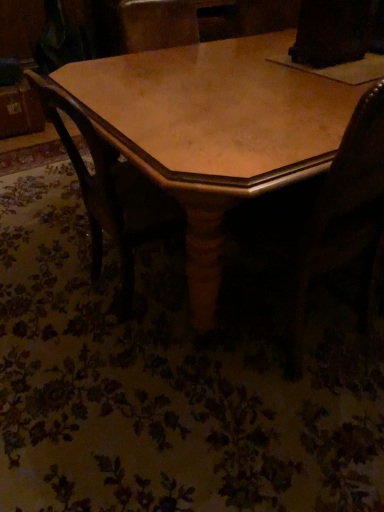
Question: Could you tell me if wooden chair at center is turned towards wooden swivel chair at center?

Choices:
 (A) yes
 (B) no

Answer: (B)

Question: Is wooden chair at center positioned far away from wooden swivel chair at center?

Choices:
 (A) no
 (B) yes

Answer: (A)

Question: Is wooden swivel chair at center surrounded by wooden chair at center?

Choices:
 (A) yes
 (B) no

Answer: (B)

Question: Can you confirm if wooden chair at center is smaller than wooden swivel chair at center?

Choices:
 (A) yes
 (B) no

Answer: (A)

Question: Considering the relative positions of wooden chair at center and wooden swivel chair at center in the image provided, is wooden chair at center to the left of wooden swivel chair at center from the viewer's perspective?

Choices:
 (A) no
 (B) yes

Answer: (B)

Question: From the image's perspective, is wooden swivel chair at center located above or below wooden table at center?

Choices:
 (A) below
 (B) above

Answer: (A)

Question: Is wooden swivel chair at center in front of or behind wooden table at center in the image?

Choices:
 (A) behind
 (B) front

Answer: (B)

Question: Is wooden swivel chair at center wider or thinner than wooden table at center?

Choices:
 (A) wide
 (B) thin

Answer: (B)

Question: From a real-world perspective, is wooden swivel chair at center above or below wooden table at center?

Choices:
 (A) below
 (B) above

Answer: (B)

Question: In the image, is wooden table at center positioned in front of or behind wooden swivel chair at center?

Choices:
 (A) front
 (B) behind

Answer: (B)

Question: Is wooden table at center inside the boundaries of wooden swivel chair at center, or outside?

Choices:
 (A) outside
 (B) inside

Answer: (A)

Question: Looking at their shapes, would you say wooden table at center is wider or thinner than wooden swivel chair at center?

Choices:
 (A) thin
 (B) wide

Answer: (B)

Question: Would you say wooden table at center is to the left or to the right of wooden swivel chair at center in the picture?

Choices:
 (A) right
 (B) left

Answer: (A)

Question: From the image's perspective, is wooden table at center above or below wooden chair at center?

Choices:
 (A) below
 (B) above

Answer: (B)

Question: Does point (51, 87) appear closer or farther from the camera than point (145, 217)?

Choices:
 (A) farther
 (B) closer

Answer: (B)